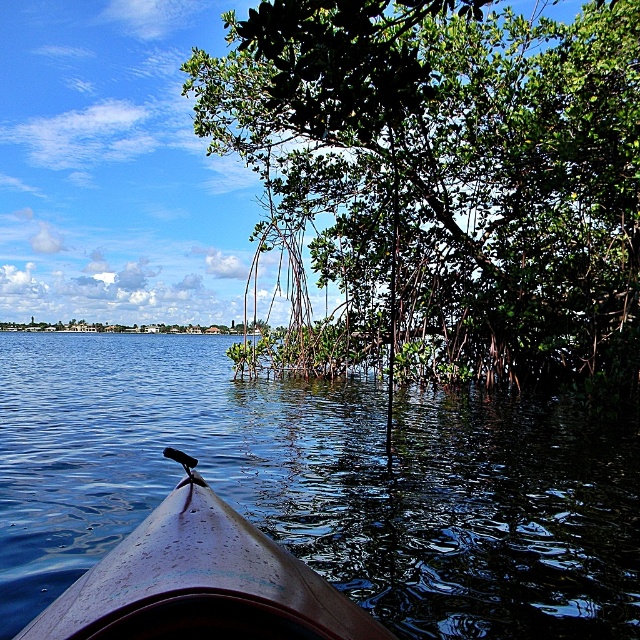
In the scene shown: You are kayaking and looking at the scene ahead. Which object, the green leafy tree at upper right or the blue glossy water at center, appears smaller in size?

The green leafy tree at upper right appears smaller in size compared to the blue glossy water at center.

You are in a kayak and want to reach the green leafy tree at upper right. Based on the distance provided, can you estimate how long it would take to paddle there if you maintain a speed of 2 miles per hour?

The distance to the green leafy tree at upper right is 20.60 feet. Converting this to miles, 20.60 feet is approximately 0.0039 miles. At a speed of 2 miles per hour, it would take roughly 0.0039 divided by 2 equals 0.00195 hours, which is about 0.117 minutes or roughly 7 seconds. However, this calculation assumes a straight path and no obstacles, which may not be the case in reality.